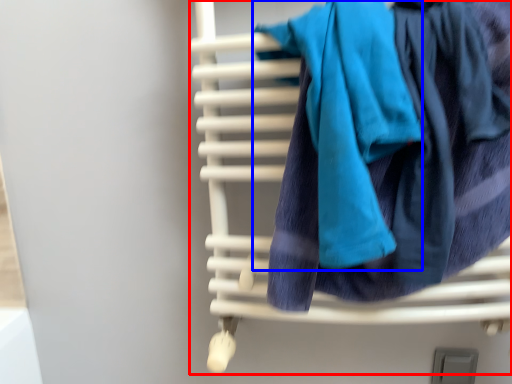
Question: Which of the following is the farthest to the observer, furniture (highlighted by a red box) or bath towel (highlighted by a blue box)?

Choices:
 (A) furniture
 (B) bath towel

Answer: (A)